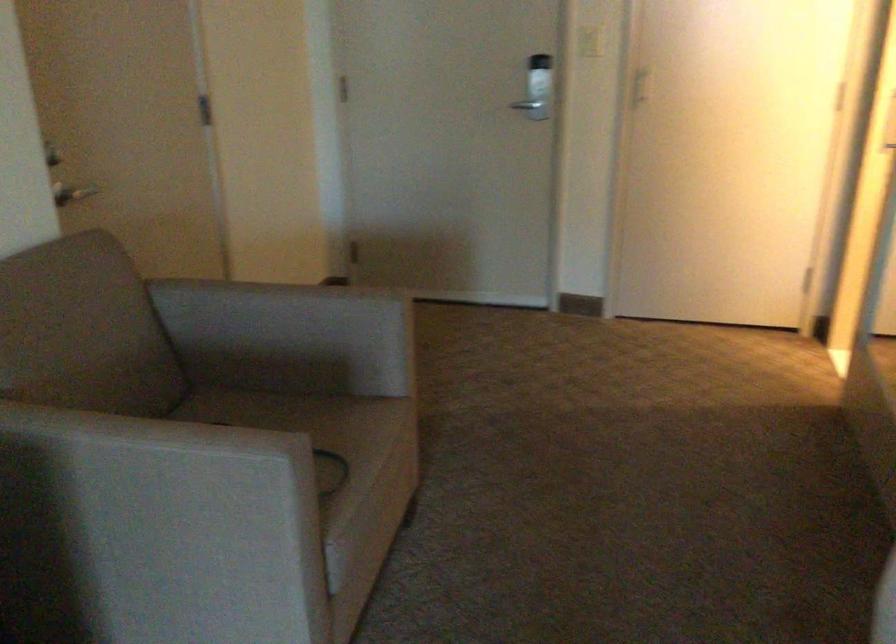
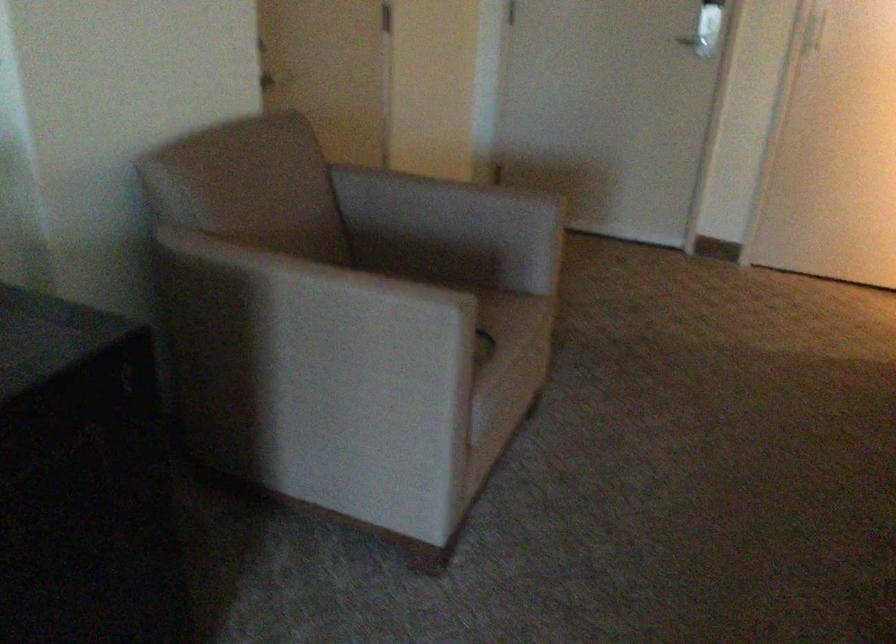
Find the pixel in the second image that matches the point at 131,488 in the first image.

(314, 325)